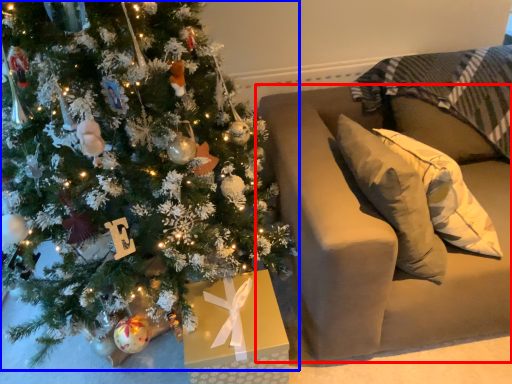
Question: Which object is closer to the camera taking this photo, furniture (highlighted by a red box) or christmas tree (highlighted by a blue box)?

Choices:
 (A) furniture
 (B) christmas tree

Answer: (B)